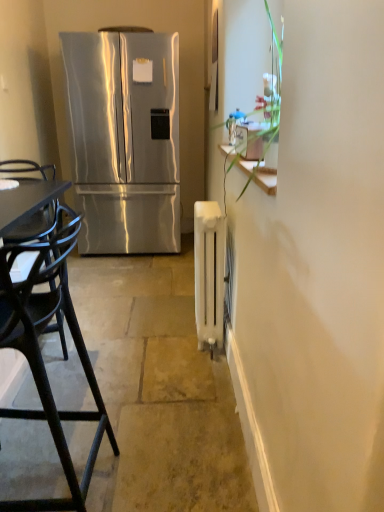
Locate an element on the screen. This screenshot has width=384, height=512. empty space that is ontop of white matte radiator at right (from a real-world perspective) is located at coordinates [143, 323].